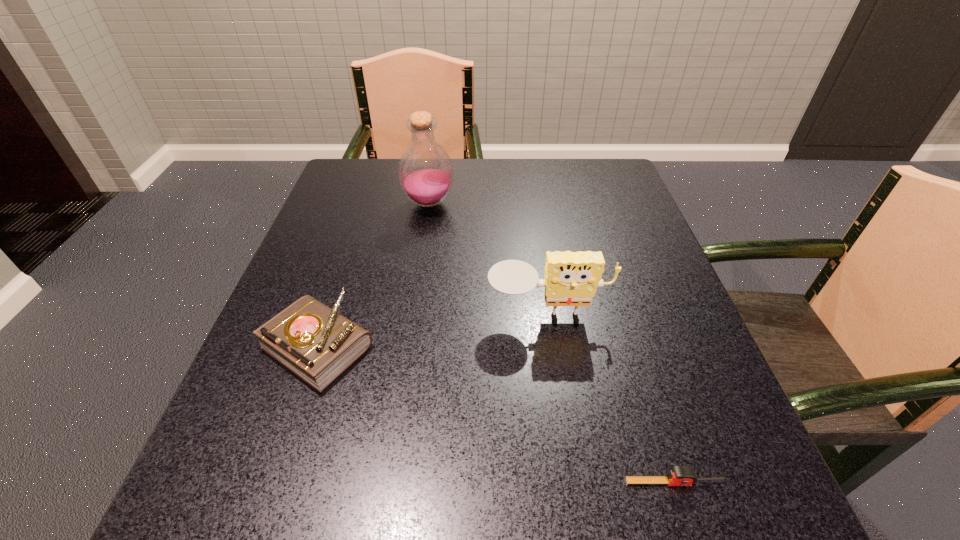
I want to click on free space between the third shortest object and the farthest object, so click(x=489, y=260).

The height and width of the screenshot is (540, 960). I want to click on free space that is in between the sponge and the shortest object, so click(611, 399).

The width and height of the screenshot is (960, 540). I want to click on empty space between the tallest object and the diary, so click(x=373, y=274).

Locate an element on the screen. The height and width of the screenshot is (540, 960). object that is the third closest to the tape measure is located at coordinates (425, 171).

In order to click on object that is the third closest to the third tallest object in this screenshot , I will do `click(678, 475)`.

Where is `vacant space that satisfies the following two spatial constraints: 1. on the front-facing side of the second tallest object; 2. on the right side of the nearest object`? vacant space that satisfies the following two spatial constraints: 1. on the front-facing side of the second tallest object; 2. on the right side of the nearest object is located at coordinates (572, 482).

The height and width of the screenshot is (540, 960). Identify the location of vacant space that satisfies the following two spatial constraints: 1. on the front-facing side of the shortest object; 2. on the left side of the second tallest object. (572, 482).